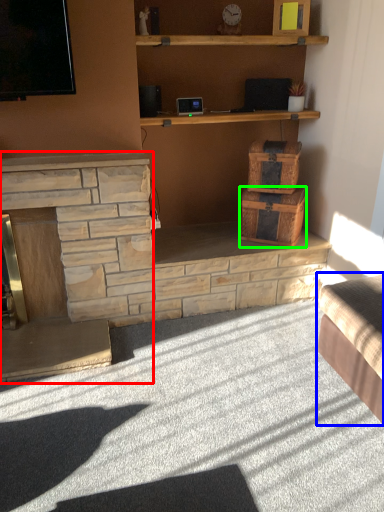
Question: Which is farther away from fireplace (highlighted by a red box)? studio couch (highlighted by a blue box) or drawer (highlighted by a green box)?

Choices:
 (A) studio couch
 (B) drawer

Answer: (A)